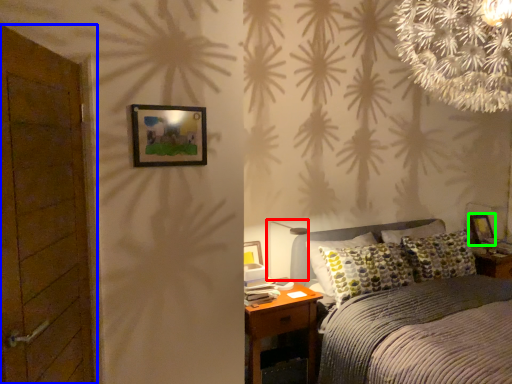
Question: Estimate the real-world distances between objects in this image. Which object is farther from table lamp (highlighted by a red box), door (highlighted by a blue box) or picture frame (highlighted by a green box)?

Choices:
 (A) door
 (B) picture frame

Answer: (B)